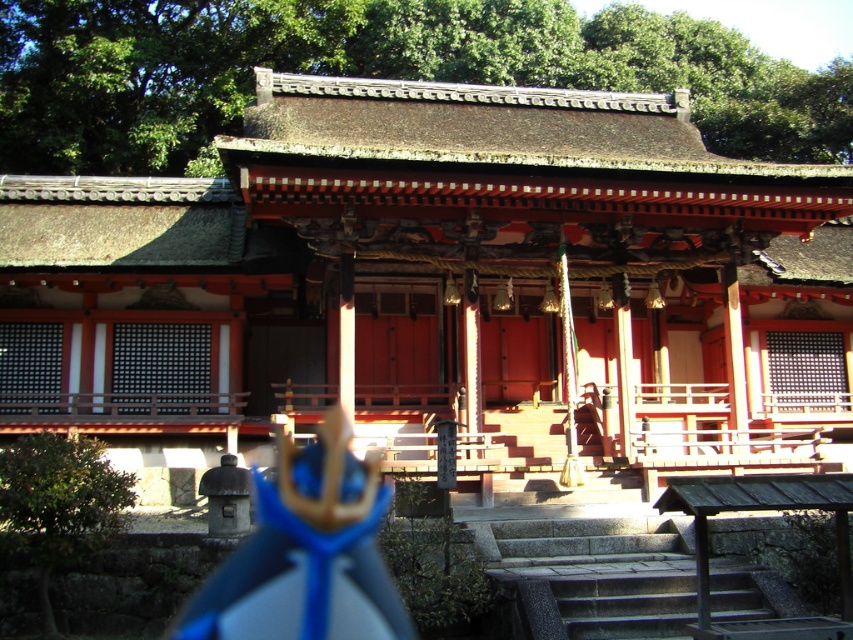
Can you confirm if matte red shrine at center is positioned above gray stone stairs at center?

Yes.

Where is `matte red shrine at center`? matte red shrine at center is located at coordinates (432, 282).